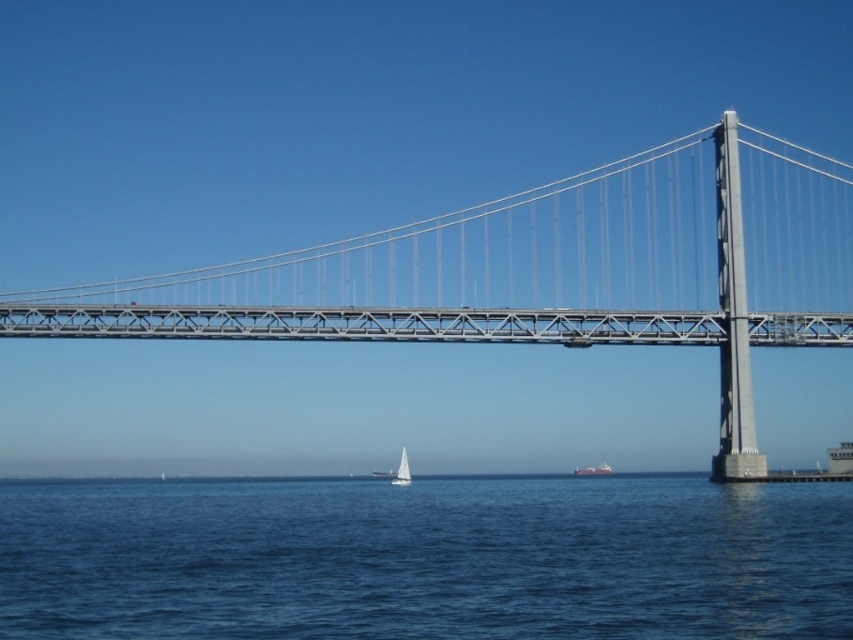
Looking at this image, you are standing at the point indicated by point (537, 273) on the image. Looking around, you see the metallic gray suspension bridge at center. What is the closest major structure to your current position?

The closest major structure to point (537, 273) is the metallic gray suspension bridge at center, as the point directly indicates its location.

You are standing on the deck of the brown matte cargo ship at center and want to reach the metallic gray suspension bridge at center. Which direction should you move to get closer to the bridge?

The metallic gray suspension bridge at center is located above the brown matte cargo ship at center, so you should move upward to get closer to the bridge.

You are standing at the point marked by the coordinate point at point (x=426, y=560). You want to walk to the nearest concrete pillar. Which direction should you head?

The blue water at center is represented by point (x=426, y=560). Since the concrete pillars are located at each end of the bridge, you should head towards the nearest end of the bridge to reach the concrete pillar.